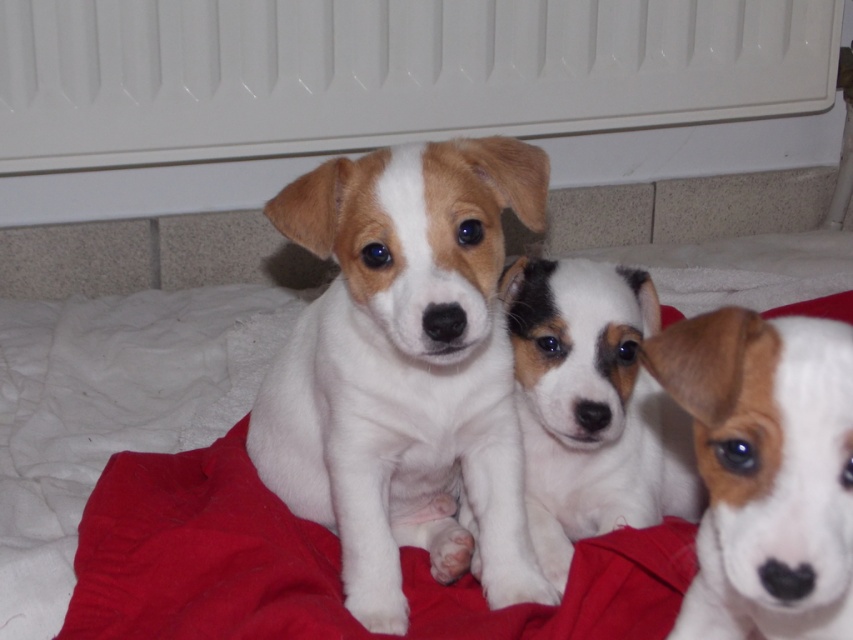
In the scene shown: You are holding a 50 cm long toy and want to place it on the floor so that it reaches from the camera to the point labeled as point [796,380]. Will the toy be long enough to span that distance?

The distance between the camera and point [796,380] is 54.75 centimeters. Since the toy is only 50 cm long, it is not long enough to span the entire distance.

You are a photographer standing in front of the white fur puppy at center. You want to take a closeup photo of it. The camera you are using requires you to be at least 24 inches away from the subject to focus properly. Is your current distance sufficient?

The white fur puppy at center is 29.08 inches from viewer, which is more than the minimum 24 inches required for the camera to focus. Therefore, the current distance is sufficient for taking a closeup photo.